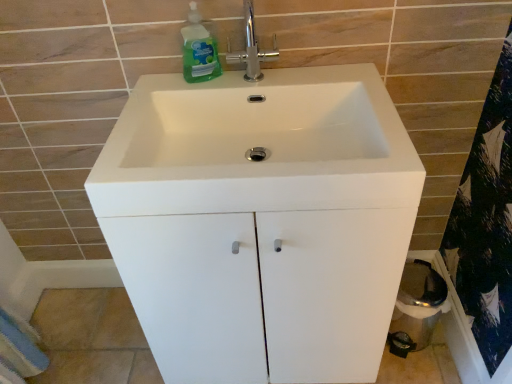
The height and width of the screenshot is (384, 512). Describe the element at coordinates (257, 146) in the screenshot. I see `white glossy sink at center` at that location.

The image size is (512, 384). What do you see at coordinates (252, 48) in the screenshot? I see `polished chrome faucet at upper center` at bounding box center [252, 48].

Where is `blue textured bath towel at lower left`? blue textured bath towel at lower left is located at coordinates point(19,350).

Describe the element at coordinates (19, 350) in the screenshot. Image resolution: width=512 pixels, height=384 pixels. I see `blue textured bath towel at lower left` at that location.

Image resolution: width=512 pixels, height=384 pixels. What do you see at coordinates (261, 288) in the screenshot?
I see `white glossy cabinet at center` at bounding box center [261, 288].

Identify the location of white glossy sink at center. (257, 146).

In terms of size, does blue textured bath towel at lower left appear bigger or smaller than polished chrome faucet at upper center?

In the image, blue textured bath towel at lower left appears to be smaller than polished chrome faucet at upper center.

Considering the relative positions of blue textured bath towel at lower left and polished chrome faucet at upper center in the image provided, is blue textured bath towel at lower left behind polished chrome faucet at upper center?

Yes.

Is blue textured bath towel at lower left wider than polished chrome faucet at upper center?

No.

Measure the distance from blue textured bath towel at lower left to polished chrome faucet at upper center.

A distance of 3.66 feet exists between blue textured bath towel at lower left and polished chrome faucet at upper center.

Image resolution: width=512 pixels, height=384 pixels. I want to click on sink that appears above the blue textured bath towel at lower left (from the image's perspective), so click(x=257, y=146).

From a real-world perspective, which object stands above the other?

white glossy sink at center is physically above.

From the image's perspective, between white glossy sink at center and blue textured bath towel at lower left, who is located below?

blue textured bath towel at lower left.

Considering the sizes of objects white glossy cabinet at center and white glossy sink at center in the image provided, who is shorter, white glossy cabinet at center or white glossy sink at center?

Standing shorter between the two is white glossy sink at center.

Does white glossy cabinet at center have a smaller size compared to white glossy sink at center?

No.

From the image's perspective, is white glossy cabinet at center above white glossy sink at center?

No, from the image's perspective, white glossy cabinet at center is not over white glossy sink at center.

Can you confirm if white glossy cabinet at center is shorter than blue textured bath towel at lower left?

No.

From the image's perspective, would you say white glossy cabinet at center is positioned over blue textured bath towel at lower left?

Indeed, from the image's perspective, white glossy cabinet at center is shown above blue textured bath towel at lower left.

From a real-world perspective, is white glossy cabinet at center above or below blue textured bath towel at lower left?

In terms of real-world spatial position, white glossy cabinet at center is above blue textured bath towel at lower left.

From the picture: Is the surface of white glossy cabinet at center in direct contact with blue textured bath towel at lower left?

No, white glossy cabinet at center is not in contact with blue textured bath towel at lower left.

Is white glossy cabinet at center positioned far away from green translucent liquid at upper left?

That's not correct — white glossy cabinet at center is a little close to green translucent liquid at upper left.

Considering the sizes of objects white glossy cabinet at center and green translucent liquid at upper left in the image provided, who is smaller, white glossy cabinet at center or green translucent liquid at upper left?

With smaller size is green translucent liquid at upper left.

From the image's perspective, is white glossy cabinet at center located above green translucent liquid at upper left?

No, from the image's perspective, white glossy cabinet at center is not on top of green translucent liquid at upper left.

From a real-world perspective, which object stands above the other?

green translucent liquid at upper left, from a real-world perspective.

From a real-world perspective, which is physically above, white glossy sink at center or green translucent liquid at upper left?

From a 3D spatial view, green translucent liquid at upper left is above.

Considering the sizes of objects white glossy sink at center and green translucent liquid at upper left in the image provided, who is bigger, white glossy sink at center or green translucent liquid at upper left?

With larger size is white glossy sink at center.

This screenshot has height=384, width=512. I want to click on sink located below the green translucent liquid at upper left (from the image's perspective), so click(257, 146).

Can you confirm if white glossy sink at center is shorter than green translucent liquid at upper left?

Indeed, white glossy sink at center has a lesser height compared to green translucent liquid at upper left.

Locate an element on the screen. The image size is (512, 384). bath towel that appears below the polished chrome faucet at upper center (from the image's perspective) is located at coordinates (19, 350).

Does polished chrome faucet at upper center have a greater height compared to blue textured bath towel at lower left?

Yes.

Considering the sizes of polished chrome faucet at upper center and blue textured bath towel at lower left in the image, is polished chrome faucet at upper center bigger or smaller than blue textured bath towel at lower left?

In the image, polished chrome faucet at upper center appears to be larger than blue textured bath towel at lower left.

Considering the sizes of objects polished chrome faucet at upper center and blue textured bath towel at lower left in the image provided, who is thinner, polished chrome faucet at upper center or blue textured bath towel at lower left?

blue textured bath towel at lower left.

Locate an element on the screen. The image size is (512, 384). tap located in front of the blue textured bath towel at lower left is located at coordinates pos(252,48).

Where is `bath towel located on the left of white glossy sink at center`? The image size is (512, 384). bath towel located on the left of white glossy sink at center is located at coordinates (19, 350).

When comparing their distances from white glossy cabinet at center, does white glossy sink at center or polished chrome faucet at upper center seem closer?

white glossy sink at center is positioned closer to the anchor white glossy cabinet at center.

Consider the image. Considering their positions, is polished chrome faucet at upper center positioned closer to white glossy sink at center than green translucent liquid at upper left?

polished chrome faucet at upper center lies closer to white glossy sink at center than the other object.

Which object lies further to the anchor point blue textured bath towel at lower left, green translucent liquid at upper left or white glossy sink at center?

green translucent liquid at upper left is further to blue textured bath towel at lower left.

When comparing their distances from white glossy sink at center, does blue textured bath towel at lower left or white glossy cabinet at center seem further?

The object further to white glossy sink at center is blue textured bath towel at lower left.

When comparing their distances from green translucent liquid at upper left, does blue textured bath towel at lower left or polished chrome faucet at upper center seem closer?

Based on the image, polished chrome faucet at upper center appears to be nearer to green translucent liquid at upper left.

Estimate the real-world distances between objects in this image. Which object is further from blue textured bath towel at lower left, white glossy cabinet at center or white glossy sink at center?

white glossy sink at center is positioned further to the anchor blue textured bath towel at lower left.

Which object lies nearer to the anchor point blue textured bath towel at lower left, white glossy cabinet at center or polished chrome faucet at upper center?

white glossy cabinet at center lies closer to blue textured bath towel at lower left than the other object.

Based on their spatial positions, is white glossy sink at center or white glossy cabinet at center further from blue textured bath towel at lower left?

white glossy sink at center is positioned further to the anchor blue textured bath towel at lower left.

The height and width of the screenshot is (384, 512). In order to click on tap located between blue textured bath towel at lower left and white glossy sink at center in the left-right direction in this screenshot , I will do `click(252, 48)`.

I want to click on cleaning product between polished chrome faucet at upper center and white glossy sink at center in the vertical direction, so click(199, 50).

The image size is (512, 384). I want to click on tap situated between blue textured bath towel at lower left and white glossy cabinet at center from left to right, so click(x=252, y=48).

What are the coordinates of `sink located between blue textured bath towel at lower left and white glossy cabinet at center in the left-right direction` in the screenshot? It's located at (257, 146).